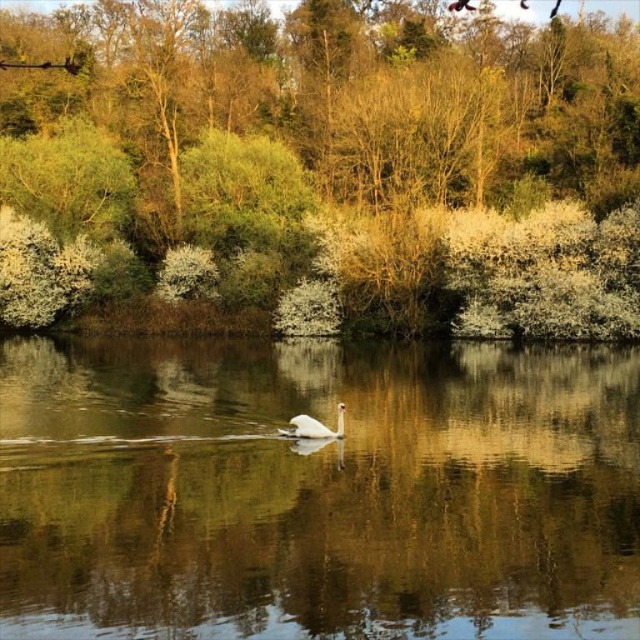
You are a photographer aiming to capture the reflection of the white swan in the clear water at center. Based on the scene description, where should you position your camera to ensure the reflection is fully visible in the frame?

The clear water at center is located at point (316, 490), so you should position your camera directly above or facing that coordinate to capture the reflection of the white swan in the clear water at center.

You are standing at the point with coordinates point (24, 198) and want to walk to the point (332, 435). According to the scene description, will you have to go through any obstacles along the way?

Point (24, 198) is behind point (332, 435), so you will have to go through point (332, 435) to reach your destination.